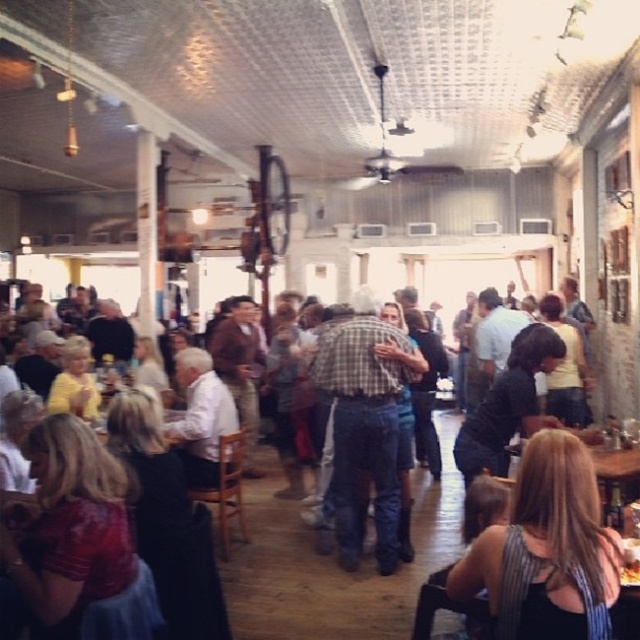
Question: Considering the relative positions of black striped tank top at lower right and plaid shirt at center in the image provided, where is black striped tank top at lower right located with respect to plaid shirt at center?

Choices:
 (A) left
 (B) right

Answer: (B)

Question: Which object appears closest to the camera in this image?

Choices:
 (A) black striped tank top at lower right
 (B) plaid shirt at center

Answer: (A)

Question: Which of the following is the farthest from the observer?

Choices:
 (A) (360, 440)
 (B) (605, 586)

Answer: (A)

Question: Can you confirm if black striped tank top at lower right is positioned to the left of plaid shirt at center?

Choices:
 (A) no
 (B) yes

Answer: (A)

Question: Is black striped tank top at lower right to the right of plaid shirt at center from the viewer's perspective?

Choices:
 (A) no
 (B) yes

Answer: (B)